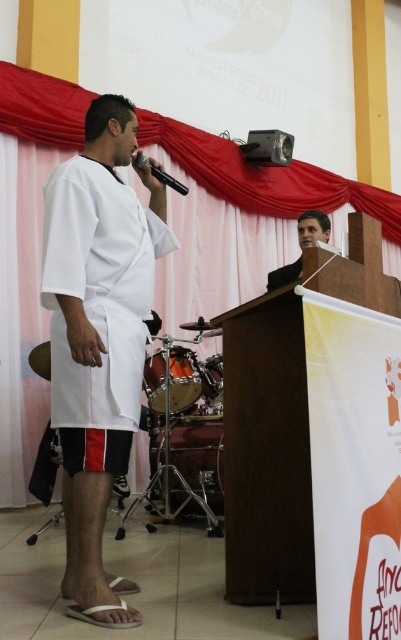
Between shiny metallic drum at lower center and matte black shirt at center, which one is positioned lower?

shiny metallic drum at lower center is lower down.

Between point (143, 374) and point (273, 289), which one is positioned in front?

Point (143, 374) is more forward.

Locate an element on the screen. The image size is (401, 640). shiny metallic drum at lower center is located at coordinates (184, 378).

Identify the location of shiny metallic drum at lower center. (184, 378).

Consider the image. Who is taller, white matte shirt at center or matte black shirt at center?

Standing taller between the two is white matte shirt at center.

Can you confirm if white matte shirt at center is smaller than matte black shirt at center?

Incorrect, white matte shirt at center is not smaller in size than matte black shirt at center.

This screenshot has width=401, height=640. What are the coordinates of `white matte shirt at center` in the screenshot? It's located at (99, 337).

Identify the location of white matte shirt at center. (99, 337).

Who is positioned more to the left, pink fabric curtain at upper center or matte black shirt at center?

Positioned to the left is matte black shirt at center.

Is pink fabric curtain at upper center thinner than matte black shirt at center?

Incorrect, pink fabric curtain at upper center's width is not less than matte black shirt at center's.

In the scene shown: Who is more distant from viewer, [212,189] or [269,273]?

The point [212,189] is behind.

Where is `pink fabric curtain at upper center`? This screenshot has width=401, height=640. pink fabric curtain at upper center is located at coordinates (241, 216).